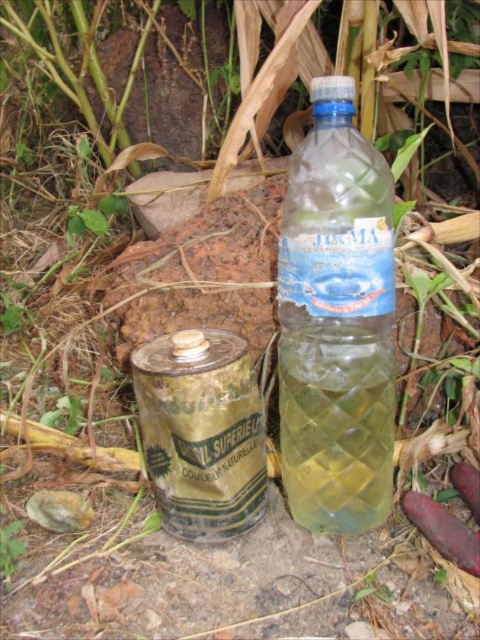
Looking at this image, you are a delivery person who needs to place a new clear plastic bottle at center exactly where the existing one is located. According to the coordinates provided, what are the coordinates where you should place the new bottle?

The coordinates for the clear plastic bottle at center are at point (336, 323).

You are organizing a recycling drive and need to sort items by size. You have a clear plastic bottle at center and a green metallic can at center. Which item is narrower?

The clear plastic bottle at center is narrower than the green metallic can at center.